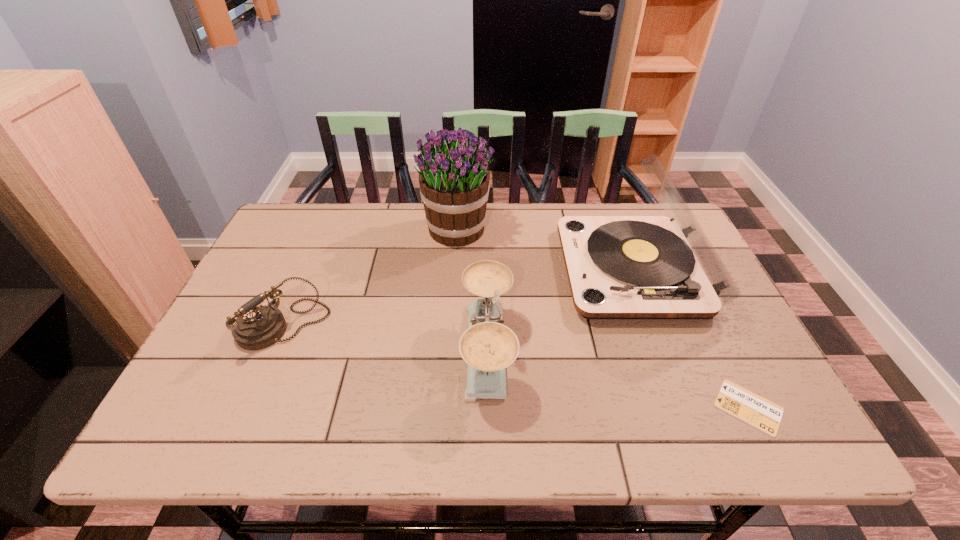
Locate an element on the screen. This screenshot has height=540, width=960. bouquet is located at coordinates (454, 181).

You are a GUI agent. You are given a task and a screenshot of the screen. Output one action in this format:
    pyautogui.click(x=<x>, y=<y>)
    Task: Click on the record player
    Image resolution: width=960 pixels, height=540 pixels.
    Given the screenshot: What is the action you would take?
    pyautogui.click(x=619, y=267)

Where is `the third tallest object`? The image size is (960, 540). the third tallest object is located at coordinates (488, 347).

Locate an element on the screen. the fourth tallest object is located at coordinates (256, 328).

The height and width of the screenshot is (540, 960). In order to click on telephone in this screenshot , I will do `click(256, 328)`.

Find the location of a particular element. The height and width of the screenshot is (540, 960). identity card is located at coordinates [739, 402].

You are a GUI agent. You are given a task and a screenshot of the screen. Output one action in this format:
    pyautogui.click(x=<x>, y=<y>)
    Task: Click on the vacant position located on the left of the bouquet
    Image resolution: width=960 pixels, height=540 pixels.
    Given the screenshot: What is the action you would take?
    pyautogui.click(x=355, y=228)

Locate an element on the screen. The image size is (960, 540). vacant region located with the tonearm facing the front of the record player is located at coordinates (535, 271).

At what (x,y) coordinates should I click in order to perform the action: click on free spot located 0.240m with the tonearm facing the front of the record player. Please return your answer as a coordinate pair (x, y). The image size is (960, 540). Looking at the image, I should click on (477, 271).

Identify the location of free space located 0.320m with the tonearm facing the front of the record player. (448, 271).